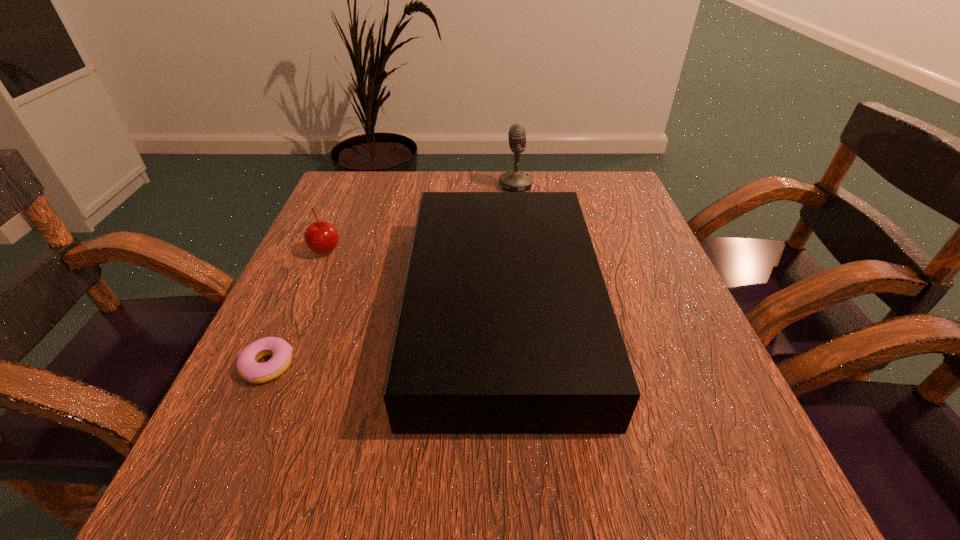
Where is `vacant region between the CD player and the shortest object`? This screenshot has width=960, height=540. vacant region between the CD player and the shortest object is located at coordinates point(385,338).

I want to click on free space between the shortest object and the CD player, so click(385, 338).

Find the location of `vacant space in between the second tallest object and the doughnut`. vacant space in between the second tallest object and the doughnut is located at coordinates (385, 338).

This screenshot has width=960, height=540. I want to click on free space between the second tallest object and the doughnut, so click(385, 338).

Image resolution: width=960 pixels, height=540 pixels. I want to click on blank region between the doughnut and the second shortest object, so click(297, 308).

This screenshot has width=960, height=540. In order to click on empty space between the CD player and the doughnut in this screenshot , I will do `click(385, 338)`.

The height and width of the screenshot is (540, 960). In order to click on the closest object relative to the third shortest object in this screenshot , I will do `click(514, 180)`.

Find the location of a particular element. This screenshot has height=540, width=960. object identified as the second closest to the farthest object is located at coordinates (322, 237).